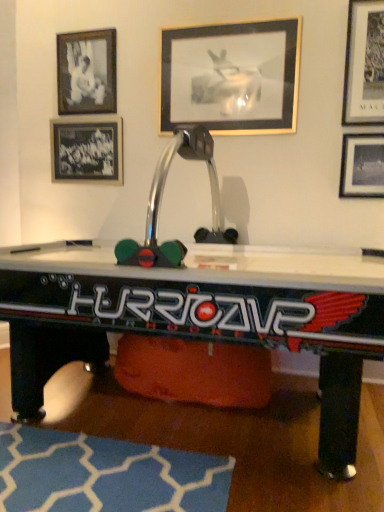
Question: From the image's perspective, is blue fabric rug at lower center on metallic silver air hockey table at center?

Choices:
 (A) yes
 (B) no

Answer: (B)

Question: Is blue fabric rug at lower center further to the viewer compared to metallic silver air hockey table at center?

Choices:
 (A) no
 (B) yes

Answer: (B)

Question: Can you confirm if blue fabric rug at lower center is smaller than metallic silver air hockey table at center?

Choices:
 (A) yes
 (B) no

Answer: (A)

Question: Can you confirm if blue fabric rug at lower center is wider than metallic silver air hockey table at center?

Choices:
 (A) no
 (B) yes

Answer: (A)

Question: From a real-world perspective, does blue fabric rug at lower center sit lower than metallic silver air hockey table at center?

Choices:
 (A) no
 (B) yes

Answer: (B)

Question: Is black matte photo frame at upper left, positioned as the 2th picture frame in left-to-right order, taller or shorter than metallic silver picture frame at upper center, the third picture frame when ordered from left to right?

Choices:
 (A) short
 (B) tall

Answer: (A)

Question: Based on their positions, is black matte photo frame at upper left, the fourth picture frame when ordered from right to left, located to the left or right of metallic silver picture frame at upper center, the third picture frame when ordered from left to right?

Choices:
 (A) left
 (B) right

Answer: (A)

Question: Is black matte photo frame at upper left, the fourth picture frame when ordered from right to left, wider or thinner than metallic silver picture frame at upper center, the 3th picture frame when ordered from right to left?

Choices:
 (A) wide
 (B) thin

Answer: (A)

Question: From a real-world perspective, is black matte photo frame at upper left, positioned as the 2th picture frame in left-to-right order, physically located above or below metallic silver picture frame at upper center, the third picture frame when ordered from left to right?

Choices:
 (A) below
 (B) above

Answer: (B)

Question: Is metallic silver picture frame at upper right, which is the 2th picture frame in right-to-left order, situated inside metallic silver picture frame at upper right, placed as the 1th picture frame when sorted from right to left, or outside?

Choices:
 (A) outside
 (B) inside

Answer: (A)

Question: In terms of height, does metallic silver picture frame at upper right, positioned as the 4th picture frame in left-to-right order, look taller or shorter compared to metallic silver picture frame at upper right, placed as the 1th picture frame when sorted from right to left?

Choices:
 (A) short
 (B) tall

Answer: (B)

Question: Is metallic silver picture frame at upper right, which is the 2th picture frame in right-to-left order, bigger or smaller than metallic silver picture frame at upper right, placed as the 1th picture frame when sorted from right to left?

Choices:
 (A) big
 (B) small

Answer: (A)

Question: Does point (354, 114) appear closer or farther from the camera than point (369, 183)?

Choices:
 (A) closer
 (B) farther

Answer: (A)

Question: Visually, is metallic silver air hockey table at center positioned to the left or to the right of black glass picture frame at upper left, marked as the 5th picture frame in a right-to-left arrangement?

Choices:
 (A) right
 (B) left

Answer: (A)

Question: In terms of width, does metallic silver air hockey table at center look wider or thinner when compared to black glass picture frame at upper left, marked as the 5th picture frame in a right-to-left arrangement?

Choices:
 (A) thin
 (B) wide

Answer: (B)